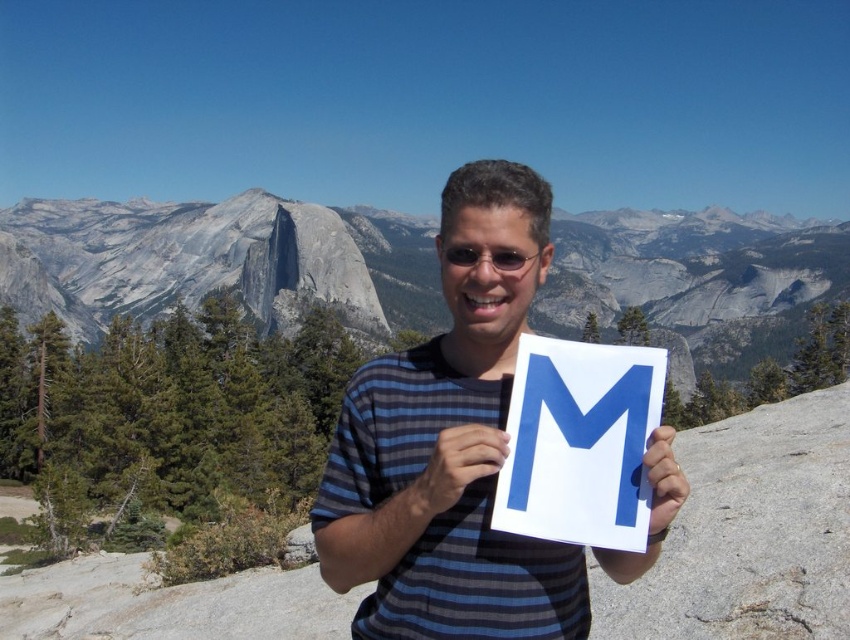
Measure the distance from blue paper letter m at center to matte plastic goggles at center.

blue paper letter m at center is 13.45 meters away from matte plastic goggles at center.

Which is more to the right, blue paper letter m at center or matte plastic goggles at center?

blue paper letter m at center is more to the right.

Where is `blue paper letter m at center`? The image size is (850, 640). blue paper letter m at center is located at coordinates click(x=579, y=442).

Between gray rock at center and white matte paper at center, which one is positioned lower?

white matte paper at center is lower down.

Is gray rock at center shorter than white matte paper at center?

Answer: No, gray rock at center is not shorter than white matte paper at center.

Does point (185, 275) lie in front of point (446, 444)?

No, (185, 275) is behind (446, 444).

Where is `gray rock at center`? Image resolution: width=850 pixels, height=640 pixels. gray rock at center is located at coordinates (218, 260).

Between blue paper sign at center and blue paper letter m at center, which one is positioned higher?

blue paper sign at center is above.

This screenshot has height=640, width=850. What do you see at coordinates (434, 444) in the screenshot?
I see `blue paper sign at center` at bounding box center [434, 444].

In order to click on blue paper sign at center in this screenshot , I will do `click(434, 444)`.